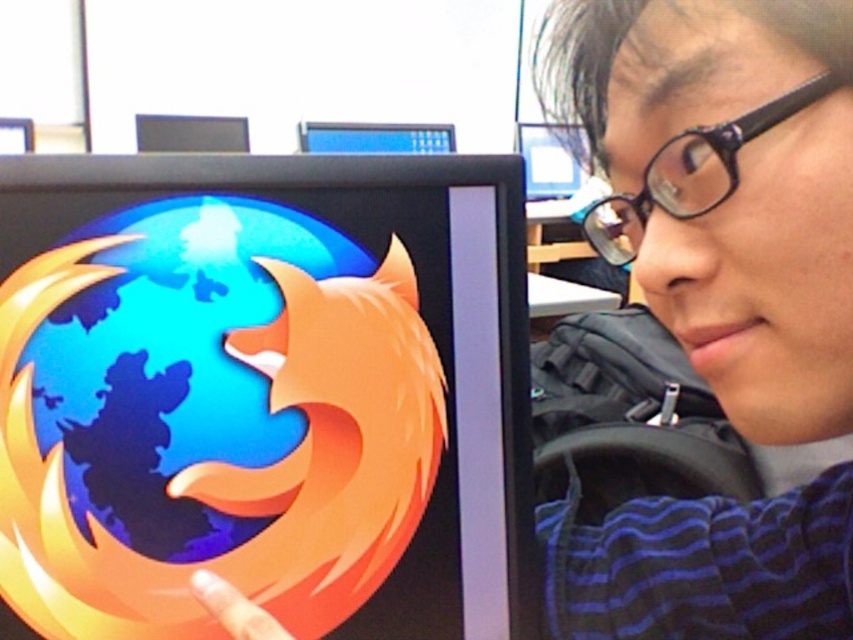
Question: Can you confirm if matte black monitor at upper center is positioned to the left of glossy plastic finger at lower left?

Choices:
 (A) yes
 (B) no

Answer: (B)

Question: Does blue glossy monitor at upper center have a greater width compared to black glossy monitor at upper center?

Choices:
 (A) no
 (B) yes

Answer: (B)

Question: Estimate the real-world distances between objects in this image. Which object is farther from the glossy plastic finger at lower left?

Choices:
 (A) black glossy monitor at upper center
 (B) glossy plastic firefox logo at center
 (C) matte black monitor at upper center
 (D) blue glossy monitor at upper center

Answer: (C)

Question: Among these points, which one is nearest to the camera?

Choices:
 (A) (260, 625)
 (B) (126, 580)
 (C) (158, 138)
 (D) (541, 195)

Answer: (A)

Question: Is blue glossy monitor at upper center wider than glossy plastic finger at lower left?

Choices:
 (A) no
 (B) yes

Answer: (B)

Question: Which of the following is the farthest from the observer?

Choices:
 (A) blue glossy monitor at upper center
 (B) matte black monitor at upper center

Answer: (B)